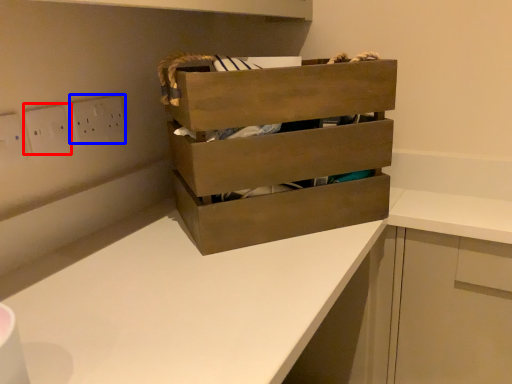
Question: Which object is closer to the camera taking this photo, electric outlet (highlighted by a red box) or electric outlet (highlighted by a blue box)?

Choices:
 (A) electric outlet
 (B) electric outlet

Answer: (A)